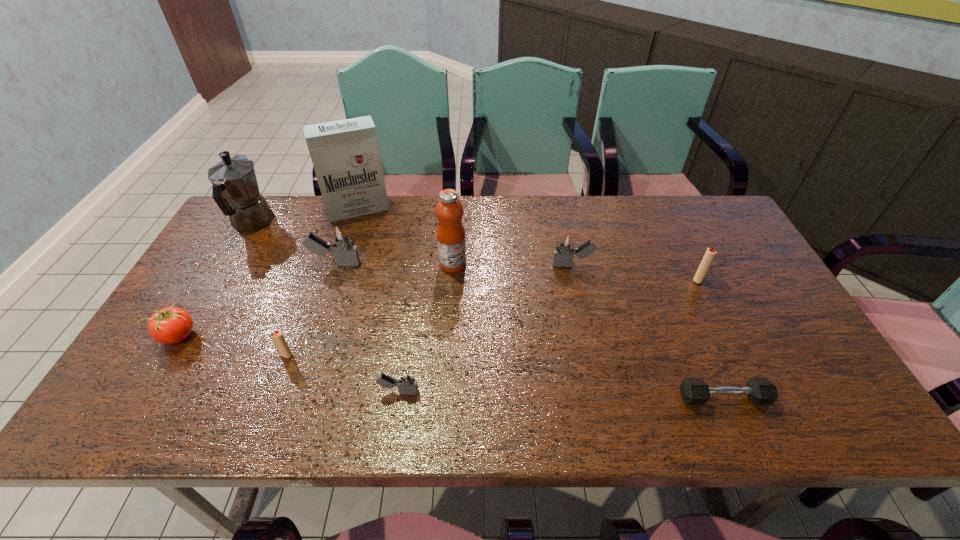
Select which igniter appears as the fourth closest to the coffeepot. Please provide its 2D coordinates. Your answer should be formatted as a tuple, i.e. [(x, y)], where the tuple contains the x and y coordinates of a point satisfying the conditions above.

[(562, 256)]

Identify which gray igniter is the closest to the tomato. Please provide its 2D coordinates. Your answer should be formatted as a tuple, i.e. [(x, y)], where the tuple contains the x and y coordinates of a point satisfying the conditions above.

[(341, 243)]

Identify which gray igniter is the third nearest to the smaller red igniter. Please provide its 2D coordinates. Your answer should be formatted as a tuple, i.e. [(x, y)], where the tuple contains the x and y coordinates of a point satisfying the conditions above.

[(562, 256)]

Where is `free region that satisfies the following two spatial constraints: 1. on the front side of the tallest object; 2. on the right side of the second igniter from right to left`? The width and height of the screenshot is (960, 540). free region that satisfies the following two spatial constraints: 1. on the front side of the tallest object; 2. on the right side of the second igniter from right to left is located at coordinates (340, 265).

The image size is (960, 540). Identify the location of free location that satisfies the following two spatial constraints: 1. on the front side of the tallest igniter; 2. on the right side of the third object from right to left. (335, 265).

I want to click on vacant space that satisfies the following two spatial constraints: 1. on the front side of the tomato; 2. on the left side of the shortest object, so click(141, 398).